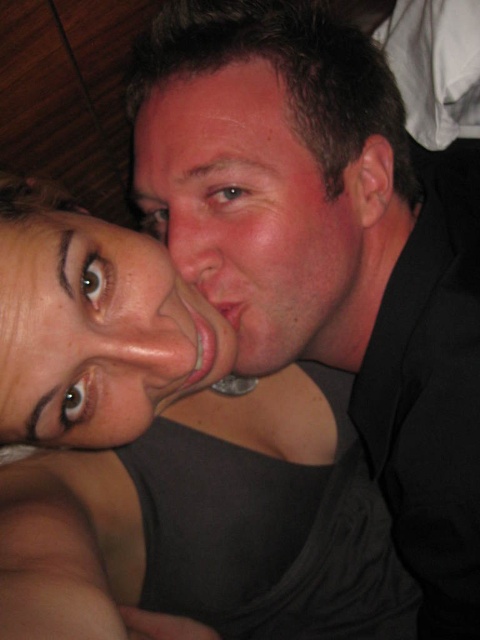
Question: From the image, what is the correct spatial relationship of matte black tank top at center in relation to smooth skin face at center?

Choices:
 (A) right
 (B) left

Answer: (B)

Question: Can you confirm if matte black tank top at center is positioned below smooth skin face at center?

Choices:
 (A) yes
 (B) no

Answer: (A)

Question: Does matte black tank top at center appear under smooth skin face at center?

Choices:
 (A) yes
 (B) no

Answer: (A)

Question: Which point is closer to the camera taking this photo?

Choices:
 (A) (264, 364)
 (B) (338, 72)

Answer: (B)

Question: Which point is closer to the camera?

Choices:
 (A) (118, 396)
 (B) (131, 300)

Answer: (B)

Question: Which of these objects is positioned closest to the smooth skin face at center?

Choices:
 (A) matte black shirt at upper right
 (B) matte skin face at lower left

Answer: (A)